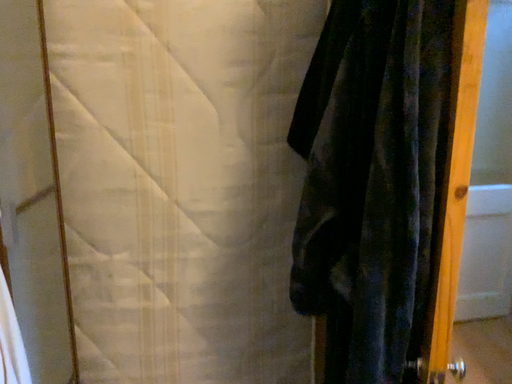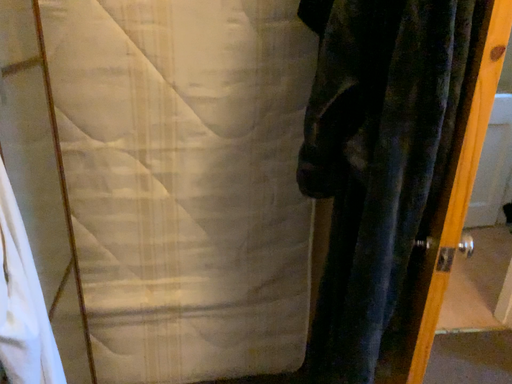
Question: How did the camera likely rotate when shooting the video?

Choices:
 (A) rotated downward
 (B) rotated upward

Answer: (A)